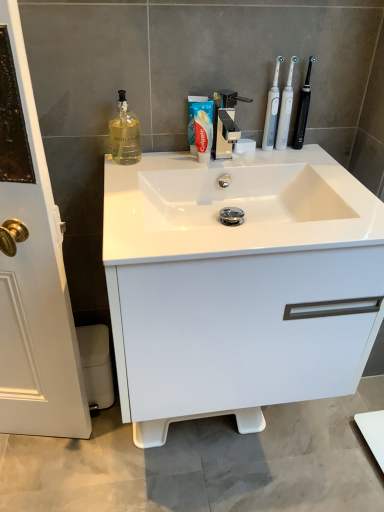
Question: Which direction should I rotate to look at white plastic toothbrush at upper center, the first toothbrush in the left-to-right sequence?

Choices:
 (A) right
 (B) left

Answer: (A)

Question: From a real-world perspective, is translucent glass bottle at upper left located beneath white plastic toothbrush at upper center, which is the third toothbrush in right-to-left order?

Choices:
 (A) no
 (B) yes

Answer: (B)

Question: Considering the relative sizes of translucent glass bottle at upper left and white plastic toothbrush at upper center, which is the third toothbrush in right-to-left order, in the image provided, is translucent glass bottle at upper left thinner than white plastic toothbrush at upper center, which is the third toothbrush in right-to-left order,?

Choices:
 (A) yes
 (B) no

Answer: (B)

Question: Is translucent glass bottle at upper left bigger than white plastic toothbrush at upper center, which is the third toothbrush in right-to-left order?

Choices:
 (A) no
 (B) yes

Answer: (B)

Question: Is translucent glass bottle at upper left located outside white plastic toothbrush at upper center, the first toothbrush in the left-to-right sequence?

Choices:
 (A) yes
 (B) no

Answer: (A)

Question: Can you confirm if translucent glass bottle at upper left is wider than white plastic toothbrush at upper center, which is the third toothbrush in right-to-left order?

Choices:
 (A) no
 (B) yes

Answer: (B)

Question: Could you tell me if translucent glass bottle at upper left is turned towards white plastic toothbrush at upper center, the first toothbrush in the left-to-right sequence?

Choices:
 (A) yes
 (B) no

Answer: (B)

Question: Considering the relative positions of white plastic toothbrush at upper center, the first toothbrush in the left-to-right sequence, and translucent glass bottle at upper left in the image provided, is white plastic toothbrush at upper center, the first toothbrush in the left-to-right sequence, to the right of translucent glass bottle at upper left from the viewer's perspective?

Choices:
 (A) no
 (B) yes

Answer: (B)

Question: From a real-world perspective, does white plastic toothbrush at upper center, the first toothbrush in the left-to-right sequence, sit lower than translucent glass bottle at upper left?

Choices:
 (A) yes
 (B) no

Answer: (B)

Question: From the image's perspective, is white plastic toothbrush at upper center, which is the third toothbrush in right-to-left order, below translucent glass bottle at upper left?

Choices:
 (A) no
 (B) yes

Answer: (A)

Question: Can you confirm if white plastic toothbrush at upper center, the first toothbrush in the left-to-right sequence, is shorter than translucent glass bottle at upper left?

Choices:
 (A) yes
 (B) no

Answer: (B)

Question: Can you confirm if white plastic toothbrush at upper center, which is the third toothbrush in right-to-left order, is positioned to the left of translucent glass bottle at upper left?

Choices:
 (A) no
 (B) yes

Answer: (A)

Question: Is the depth of white plastic toothbrush at upper center, which is the third toothbrush in right-to-left order, less than that of translucent glass bottle at upper left?

Choices:
 (A) yes
 (B) no

Answer: (B)

Question: Can we say white plastic toothbrush at upper right, the second toothbrush viewed from the right, lies outside black plastic toothbrush at upper right, positioned as the first toothbrush in right-to-left order?

Choices:
 (A) yes
 (B) no

Answer: (A)